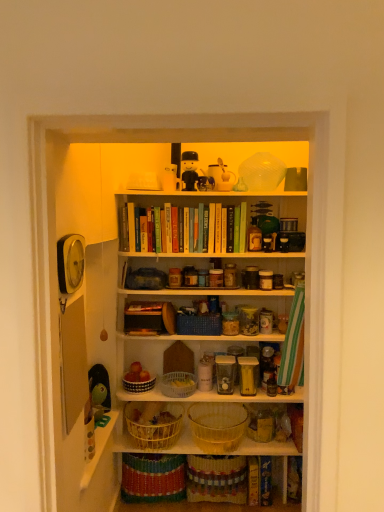
How much space does brightly colored woven baskets at lower center, which ranks as the 2th shelf in top-to-bottom order, occupy vertically?

brightly colored woven baskets at lower center, which ranks as the 2th shelf in top-to-bottom order, is 0.84 inches tall.

Locate an element on the screen. woven yellow basket at center, placed as the fourth basket when sorted from top to bottom is located at coordinates (217, 426).

This screenshot has height=512, width=384. What do you see at coordinates (178, 384) in the screenshot?
I see `clear plastic basket at center, the third basket ordered from the bottom` at bounding box center [178, 384].

Image resolution: width=384 pixels, height=512 pixels. What do you see at coordinates (253, 481) in the screenshot?
I see `hardcover book at center, which ranks as the 2th book in right-to-left order` at bounding box center [253, 481].

In order to click on white plastic spoon at upper center, which appears as the 1th toy when viewed from the right in this screenshot , I will do `click(222, 176)`.

In order to click on brightly colored woven baskets at lower center, which ranks as the 2th shelf in top-to-bottom order in this screenshot , I will do `click(209, 506)`.

Choose the correct answer: Is blue woven basket at center, which is the fifth basket from bottom to top, inside black plastic toy at upper center, which is the fourth toy in bottom-to-top order, or outside it?

A: blue woven basket at center, which is the fifth basket from bottom to top, exists outside the volume of black plastic toy at upper center, which is the fourth toy in bottom-to-top order.

In the image, is blue woven basket at center, which is the fifth basket from bottom to top, positioned in front of or behind black plastic toy at upper center, which is counted as the 1th toy, starting from the top?

Visually, blue woven basket at center, which is the fifth basket from bottom to top, is located behind black plastic toy at upper center, which is counted as the 1th toy, starting from the top.

From the image's perspective, starting from the black plastic toy at upper center, the 2th toy when ordered from left to right, which basket is the 1st one below? Please provide its 2D coordinates.

[(199, 324)]

Is blue woven basket at center, which is the fifth basket from bottom to top, positioned with its back to black plastic toy at upper center, which is the fourth toy in bottom-to-top order?

No, black plastic toy at upper center, which is the fourth toy in bottom-to-top order, is not at the back of blue woven basket at center, which is the fifth basket from bottom to top.

How many degrees apart are the facing directions of brightly colored woven baskets at lower center, the second shelf in the front-to-back sequence, and green rubber duck at left, placed as the 4th toy when sorted from right to left?

There is a 102-degree angle between the facing directions of brightly colored woven baskets at lower center, the second shelf in the front-to-back sequence, and green rubber duck at left, placed as the 4th toy when sorted from right to left.

Does point (123, 505) appear closer or farther from the camera than point (91, 367)?

Clearly, point (123, 505) is more distant from the camera than point (91, 367).

Considering the relative sizes of brightly colored woven baskets at lower center, which ranks as the 2th shelf in top-to-bottom order, and green rubber duck at left, positioned as the first toy in left-to-right order, in the image provided, is brightly colored woven baskets at lower center, which ranks as the 2th shelf in top-to-bottom order, taller than green rubber duck at left, positioned as the first toy in left-to-right order,?

In fact, brightly colored woven baskets at lower center, which ranks as the 2th shelf in top-to-bottom order, may be shorter than green rubber duck at left, positioned as the first toy in left-to-right order.

From the picture: From a real-world perspective, is brightly colored woven baskets at lower center, which ranks as the 2th shelf in top-to-bottom order, under green rubber duck at left, positioned as the fourth toy in top-to-bottom order?

Yes, from a real-world perspective, brightly colored woven baskets at lower center, which ranks as the 2th shelf in top-to-bottom order, is beneath green rubber duck at left, positioned as the fourth toy in top-to-bottom order.

Is green rubber duck at left, positioned as the first toy in left-to-right order, positioned with its back to white plastic spoon at upper center, the 3th toy in the bottom-to-top sequence?

No.

Which of these two, green rubber duck at left, positioned as the first toy in left-to-right order, or white plastic spoon at upper center, acting as the 4th toy starting from the left, is wider?

Wider between the two is green rubber duck at left, positioned as the first toy in left-to-right order.

Can you tell me how much green rubber duck at left, which appears as the 1th toy when ordered from the bottom, and white plastic spoon at upper center, acting as the 4th toy starting from the left, differ in facing direction?

99.6 degrees.

In the scene shown: Which object is further away from the camera taking this photo, green rubber duck at left, positioned as the fourth toy in top-to-bottom order, or white plastic spoon at upper center, which appears as the 1th toy when viewed from the right?

white plastic spoon at upper center, which appears as the 1th toy when viewed from the right, is further from the camera.

Does blue woven basket at center, placed as the first basket when sorted from top to bottom, have a smaller size compared to white woven basket at lower center, the 2th basket when ordered from top to bottom?

No.

Does blue woven basket at center, which is the fifth basket from bottom to top, have a greater width compared to white woven basket at lower center, the 2th basket when ordered from top to bottom?

Incorrect, the width of blue woven basket at center, which is the fifth basket from bottom to top, does not surpass that of white woven basket at lower center, the 2th basket when ordered from top to bottom.

From a real-world perspective, who is located lower, blue woven basket at center, which is the fifth basket from bottom to top, or white woven basket at lower center, the 4th basket positioned from the bottom?

From a 3D spatial view, white woven basket at lower center, the 4th basket positioned from the bottom, is below.

Is blue woven basket at center, placed as the first basket when sorted from top to bottom, outside of white woven basket at lower center, the 4th basket positioned from the bottom?

Yes.

How distant is wooden shelf at center, the second shelf positioned from the bottom, from yellow wicker basket at lower center, the 1th basket when ordered from bottom to top?

20.52 inches.

Which point is more distant from viewer, (129, 312) or (168, 444)?

The point (168, 444) is farther.

Looking at their sizes, would you say wooden shelf at center, acting as the first shelf starting from the front, is wider or thinner than yellow wicker basket at lower center, the fifth basket positioned from the top?

Clearly, wooden shelf at center, acting as the first shelf starting from the front, has less width compared to yellow wicker basket at lower center, the fifth basket positioned from the top.

Is wooden shelf at center, the 2th shelf viewed from the back, not near yellow wicker basket at lower center, the fifth basket positioned from the top?

No.

Considering the relative positions of wooden shelf at center, the 2th shelf viewed from the back, and brightly colored woven baskets at lower center, which ranks as the 1th shelf in bottom-to-top order, in the image provided, is wooden shelf at center, the 2th shelf viewed from the back, to the left of brightly colored woven baskets at lower center, which ranks as the 1th shelf in bottom-to-top order, from the viewer's perspective?

Indeed, wooden shelf at center, the 2th shelf viewed from the back, is positioned on the left side of brightly colored woven baskets at lower center, which ranks as the 1th shelf in bottom-to-top order.

In terms of width, does wooden shelf at center, acting as the first shelf starting from the front, look wider or thinner when compared to brightly colored woven baskets at lower center, which ranks as the 2th shelf in top-to-bottom order?

Clearly, wooden shelf at center, acting as the first shelf starting from the front, has less width compared to brightly colored woven baskets at lower center, which ranks as the 2th shelf in top-to-bottom order.

From the image's perspective, is wooden shelf at center, the 2th shelf viewed from the back, below brightly colored woven baskets at lower center, which ranks as the 1th shelf in back-to-front order?

No.

Does wooden shelf at center, marked as the 1th shelf in a top-to-bottom arrangement, have a lesser height compared to brightly colored woven baskets at lower center, which ranks as the 2th shelf in top-to-bottom order?

No, wooden shelf at center, marked as the 1th shelf in a top-to-bottom arrangement, is not shorter than brightly colored woven baskets at lower center, which ranks as the 2th shelf in top-to-bottom order.

From the image's perspective, is white woven basket at lower center, the 2th basket when ordered from top to bottom, beneath blue woven basket at center, placed as the first basket when sorted from top to bottom?

Yes, from the image's perspective, white woven basket at lower center, the 2th basket when ordered from top to bottom, is below blue woven basket at center, placed as the first basket when sorted from top to bottom.

From the image's perspective, which basket is the 1st one below the blue woven basket at center, placed as the first basket when sorted from top to bottom? Please provide its 2D coordinates.

[(139, 385)]

Is white woven basket at lower center, the 2th basket when ordered from top to bottom, beside blue woven basket at center, placed as the first basket when sorted from top to bottom?

white woven basket at lower center, the 2th basket when ordered from top to bottom, and blue woven basket at center, placed as the first basket when sorted from top to bottom, are clearly separated.

Which basket is the 1st one when counting from the right side of the black plastic toy at upper center, which is the fourth toy in bottom-to-top order? Please provide its 2D coordinates.

[(199, 324)]

Identify the location of shelf below the green rubber duck at left, positioned as the first toy in left-to-right order (from a real-world perspective). This screenshot has width=384, height=512. (209, 506).

Based on the photo, from the image, which object appears to be farther from blue woven basket at center, which is the fifth basket from bottom to top, hardcover book at lower right, marked as the second book in a left-to-right arrangement, or wooden shelf at center, the second shelf positioned from the bottom?

hardcover book at lower right, marked as the second book in a left-to-right arrangement, is further to blue woven basket at center, which is the fifth basket from bottom to top.

Considering their positions, is blue woven basket at center, which is the fifth basket from bottom to top, positioned further to woven yellow basket at center, the 2th basket when ordered from bottom to top, than hardcover book at center, placed as the 1th book when sorted from left to right?

Among the two, blue woven basket at center, which is the fifth basket from bottom to top, is located further to woven yellow basket at center, the 2th basket when ordered from bottom to top.

From the image, which object appears to be nearer to yellow wicker basket at lower center, the fifth basket positioned from the top, green rubber duck at left, positioned as the fourth toy in top-to-bottom order, or clear plastic basket at center, the 3th basket in the top-to-bottom sequence?

Based on the image, clear plastic basket at center, the 3th basket in the top-to-bottom sequence, appears to be nearer to yellow wicker basket at lower center, the fifth basket positioned from the top.

Which object lies further to the anchor point white woven basket at lower center, the 2th basket when ordered from top to bottom, blue woven basket at center, which is the fifth basket from bottom to top, or yellow wicker basket at lower center, the 1th basket when ordered from bottom to top?

blue woven basket at center, which is the fifth basket from bottom to top.

Based on the photo, looking at the image, which one is located further to wooden shelf at center, the second shelf positioned from the bottom, blue woven basket at center, which is the fifth basket from bottom to top, or white plastic spoon at upper center, which appears as the 1th toy when viewed from the right?

The object further to wooden shelf at center, the second shelf positioned from the bottom, is white plastic spoon at upper center, which appears as the 1th toy when viewed from the right.

Looking at the image, which one is located further to black plastic toy at upper center, the 2th toy when ordered from left to right, yellow wicker basket at lower center, the 1th basket when ordered from bottom to top, or white plastic spoon at upper center, arranged as the second toy when viewed from the top?

The object further to black plastic toy at upper center, the 2th toy when ordered from left to right, is yellow wicker basket at lower center, the 1th basket when ordered from bottom to top.

Considering their positions, is green rubber duck at left, positioned as the first toy in left-to-right order, positioned closer to woven yellow basket at center, the 2th basket when ordered from bottom to top, than hardcover book at lower right, the 1th book in the right-to-left sequence?

hardcover book at lower right, the 1th book in the right-to-left sequence, lies closer to woven yellow basket at center, the 2th basket when ordered from bottom to top, than the other object.

When comparing their distances from clear plastic basket at center, the third basket ordered from the bottom, does black plastic toy at upper center, which is the fourth toy in bottom-to-top order, or brightly colored woven baskets at lower center, which ranks as the 2th shelf in top-to-bottom order, seem closer?

brightly colored woven baskets at lower center, which ranks as the 2th shelf in top-to-bottom order, is closer to clear plastic basket at center, the third basket ordered from the bottom.

Locate an element on the screen. toy positioned between wooden shelf at center, acting as the first shelf starting from the front, and matte plastic figurine at upper center, which is the second toy in right-to-left order, from near to far is located at coordinates (190, 169).

Find the location of a particular element. This screenshot has height=512, width=384. shelf that lies between white plastic spoon at upper center, the 3th toy in the bottom-to-top sequence, and brightly colored woven baskets at lower center, which ranks as the 1th shelf in bottom-to-top order, from top to bottom is located at coordinates (211, 313).

In order to click on toy between white plastic spoon at upper center, arranged as the second toy when viewed from the top, and blue woven basket at center, which is the fifth basket from bottom to top, vertically in this screenshot , I will do `click(204, 183)`.

The height and width of the screenshot is (512, 384). I want to click on toy that lies between white plastic spoon at upper center, arranged as the second toy when viewed from the top, and white woven basket at lower center, the 2th basket when ordered from top to bottom, from top to bottom, so click(204, 183).